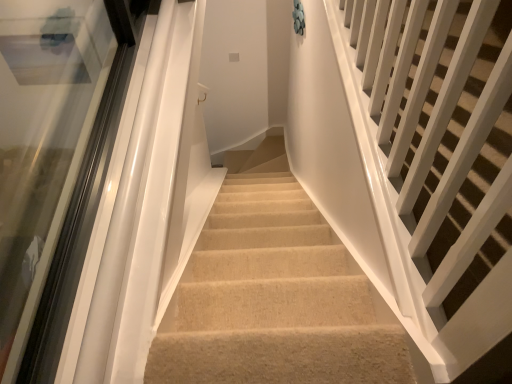
Question: Is white glossy railings at upper right in front of or behind transparent glass door at left in the image?

Choices:
 (A) front
 (B) behind

Answer: (A)

Question: Considering the positions of white glossy railings at upper right and transparent glass door at left in the image, is white glossy railings at upper right wider or thinner than transparent glass door at left?

Choices:
 (A) thin
 (B) wide

Answer: (B)

Question: From their relative heights in the image, would you say white glossy railings at upper right is taller or shorter than transparent glass door at left?

Choices:
 (A) tall
 (B) short

Answer: (A)

Question: From the image's perspective, is transparent glass door at left located above or below white glossy railings at upper right?

Choices:
 (A) below
 (B) above

Answer: (A)

Question: Is point (19, 102) closer or farther from the camera than point (450, 294)?

Choices:
 (A) closer
 (B) farther

Answer: (B)

Question: Is transparent glass door at left situated inside white glossy railings at upper right or outside?

Choices:
 (A) outside
 (B) inside

Answer: (A)

Question: Looking at their shapes, would you say transparent glass door at left is wider or thinner than white glossy railings at upper right?

Choices:
 (A) wide
 (B) thin

Answer: (B)